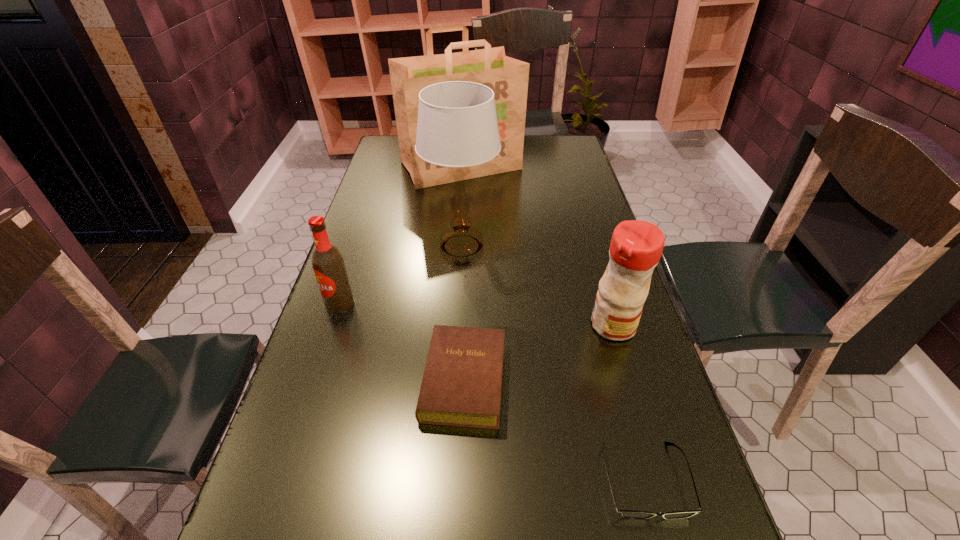
Image resolution: width=960 pixels, height=540 pixels. I want to click on free point located 0.140m on the right of the beer bottle, so click(x=408, y=303).

At what (x,y) coordinates should I click in order to perform the action: click on vacant space situated 0.050m on the right of the second shortest object. Please return your answer as a coordinate pair (x, y). This screenshot has width=960, height=540. Looking at the image, I should click on (x=528, y=381).

At what (x,y) coordinates should I click in order to perform the action: click on object that is positioned at the far edge. Please return your answer as a coordinate pair (x, y). Looking at the image, I should click on (508, 78).

Identify the location of grocery bag present at the left edge. (508, 78).

The height and width of the screenshot is (540, 960). What are the coordinates of `beer bottle located at the left edge` in the screenshot? It's located at (327, 261).

At what (x,y) coordinates should I click in order to perform the action: click on condiment located at the right edge. Please return your answer as a coordinate pair (x, y). The image size is (960, 540). Looking at the image, I should click on (636, 246).

Image resolution: width=960 pixels, height=540 pixels. Identify the location of spectacles that is at the right edge. coord(631,514).

Find the location of a particular element. Image resolution: width=960 pixels, height=540 pixels. object located in the far left corner section of the desktop is located at coordinates (508, 78).

In the image, there is a desktop. Identify the location of free space at the left edge. The image size is (960, 540). (337, 360).

Find the location of a particular element. Image resolution: width=960 pixels, height=540 pixels. vacant region at the right edge of the desktop is located at coordinates (599, 369).